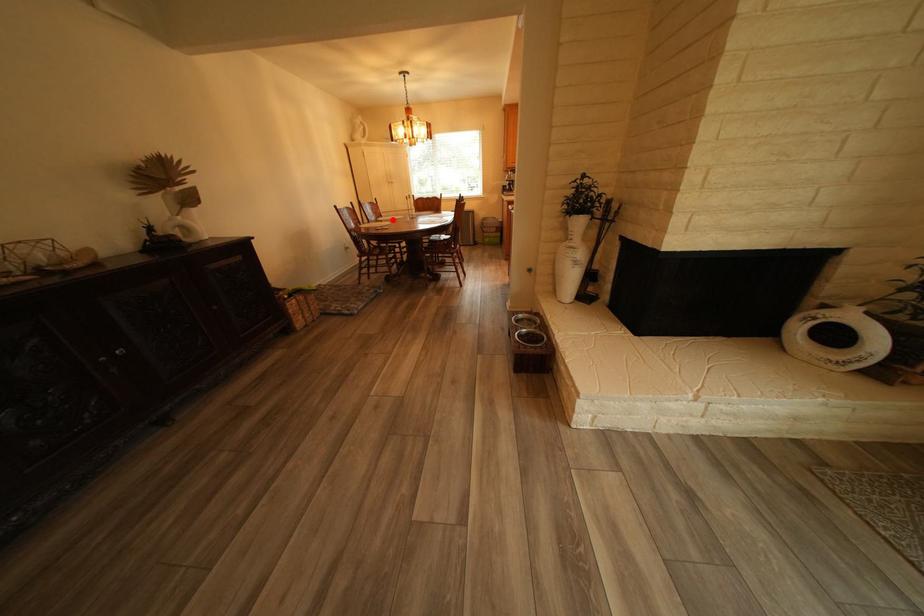
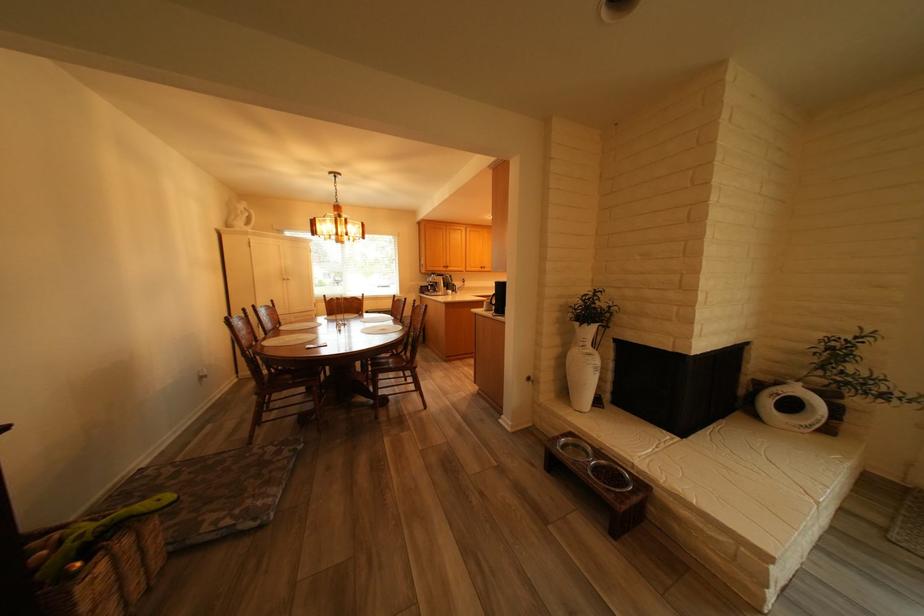
Where in the second image is the point corresponding to the highlighted location from the first image?

(295, 330)